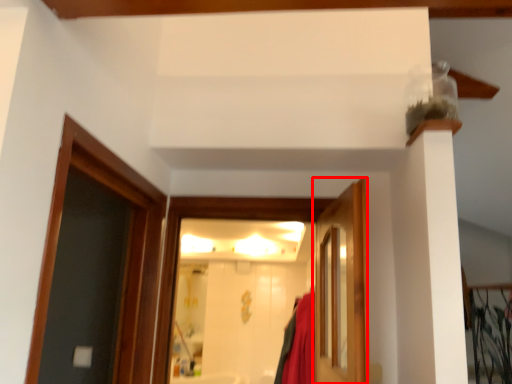
Question: From the image's perspective, what is the correct spatial positioning of door (annotated by the red box) in reference to door?

Choices:
 (A) below
 (B) above

Answer: (B)